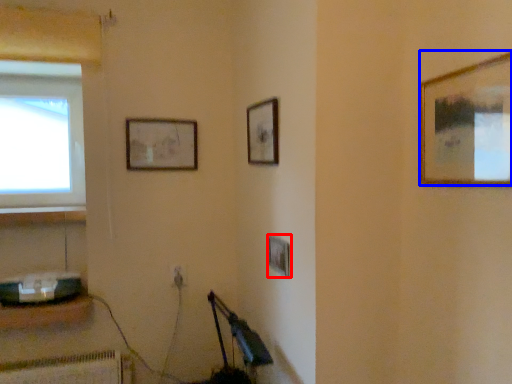
Question: Which point is closer to the camera, picture frame (highlighted by a red box) or picture frame (highlighted by a blue box)?

Choices:
 (A) picture frame
 (B) picture frame

Answer: (B)